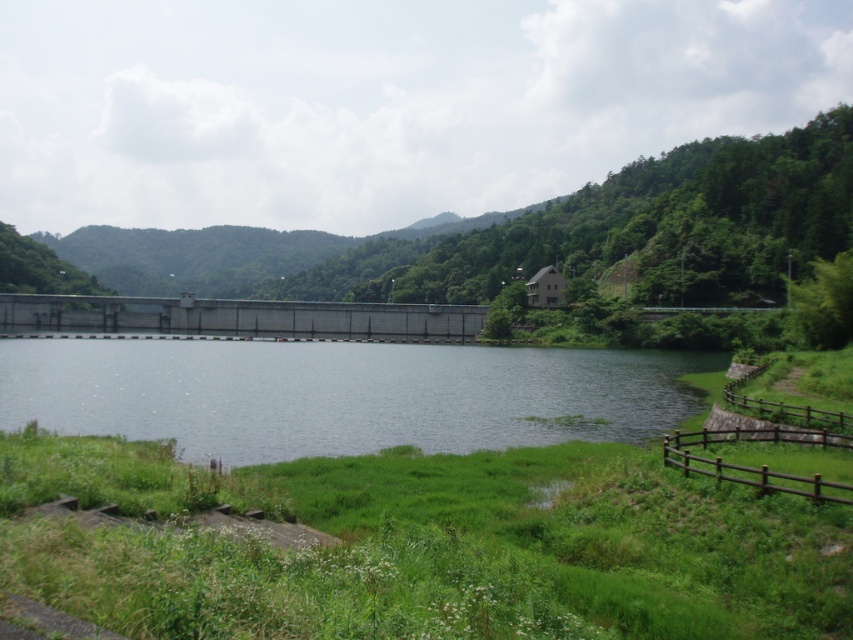
You are a visitor at the reservoir and want to take a photo of the clear water at center and the concrete dam at center. Which one should you point your camera towards if you are standing on the grassy area in the foreground?

You should point your camera towards the clear water at center because it is located below the concrete dam at center, making it visible from the grassy area in the foreground.

You are standing at the wooden fence on the right side of the landscape. You see two points marked on the image, point (x=114, y=412) and point (x=123, y=301). Which point is closer to you?

Point (x=114, y=412) is in front of point (x=123, y=301), so it is closer to you.